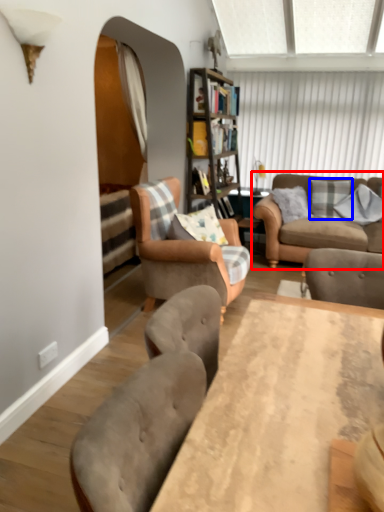
Question: Which point is closer to the camera, studio couch (highlighted by a red box) or pillow (highlighted by a blue box)?

Choices:
 (A) studio couch
 (B) pillow

Answer: (A)